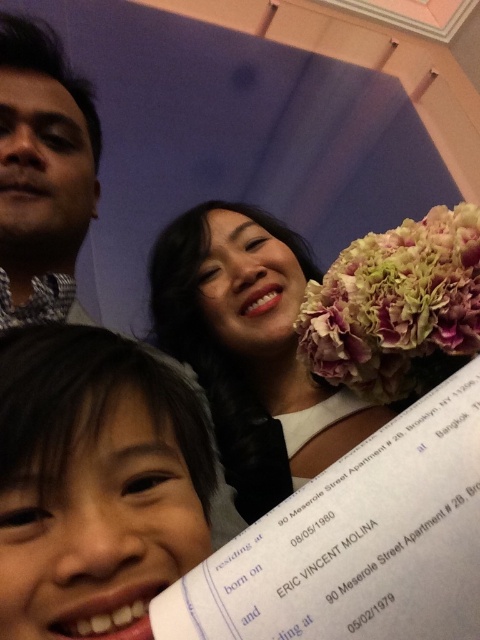
Can you confirm if smooth white dress at center is positioned below matte black shirt at upper left?

Indeed, smooth white dress at center is positioned under matte black shirt at upper left.

The height and width of the screenshot is (640, 480). What do you see at coordinates (245, 344) in the screenshot?
I see `smooth white dress at center` at bounding box center [245, 344].

This screenshot has height=640, width=480. Find the location of `smooth white dress at center`. smooth white dress at center is located at coordinates (245, 344).

Is smooth skin face at lower left above smooth white dress at center?

No, smooth skin face at lower left is not above smooth white dress at center.

This screenshot has width=480, height=640. I want to click on smooth skin face at lower left, so click(95, 481).

Locate an element on the screen. smooth skin face at lower left is located at coordinates (95, 481).

Does smooth skin face at lower left appear over matte black shirt at upper left?

No, smooth skin face at lower left is not above matte black shirt at upper left.

Is point (73, 534) farther from viewer compared to point (44, 129)?

No, it is in front of (44, 129).

Is point (25, 493) behind point (12, 115)?

That is False.

At what (x,y) coordinates should I click in order to perform the action: click on smooth skin face at lower left. Please return your answer as a coordinate pair (x, y). This screenshot has height=640, width=480. Looking at the image, I should click on (95, 481).